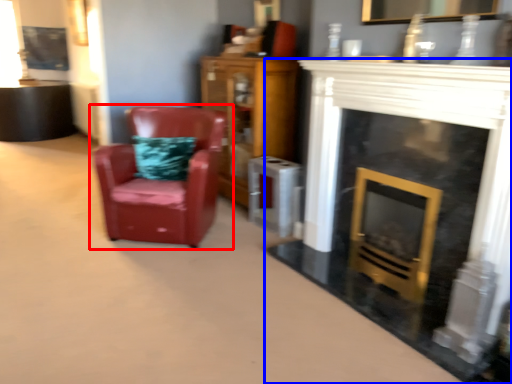
Question: Among these objects, which one is nearest to the camera, chair (highlighted by a red box) or fireplace (highlighted by a blue box)?

Choices:
 (A) chair
 (B) fireplace

Answer: (B)